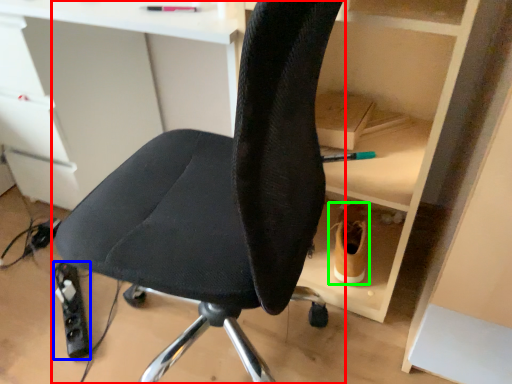
Question: Based on their relative distances, which object is farther from chair (highlighted by a red box)? Choose from equipment (highlighted by a blue box) and footwear (highlighted by a green box).

Choices:
 (A) equipment
 (B) footwear

Answer: (A)